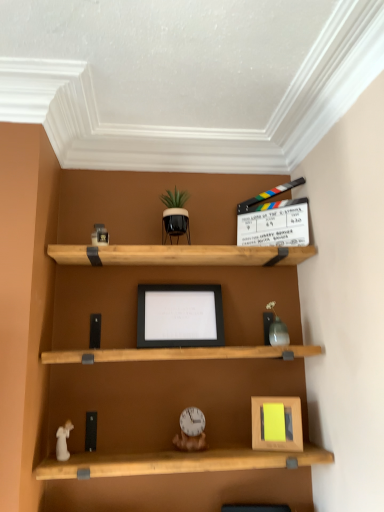
Question: Does white porcelain angel at lower left, marked as the 2th toy in a bottom-to-top arrangement, turn towards black matte picture frame at center, positioned as the first picture frame in back-to-front order?

Choices:
 (A) no
 (B) yes

Answer: (A)

Question: Considering the relative sizes of white porcelain angel at lower left, which is counted as the 3th toy, starting from the top, and black matte picture frame at center, placed as the second picture frame when sorted from bottom to top, in the image provided, is white porcelain angel at lower left, which is counted as the 3th toy, starting from the top, bigger than black matte picture frame at center, placed as the second picture frame when sorted from bottom to top,?

Choices:
 (A) yes
 (B) no

Answer: (B)

Question: Can you confirm if white porcelain angel at lower left, the first toy in the left-to-right sequence, is wider than black matte picture frame at center, placed as the second picture frame when sorted from bottom to top?

Choices:
 (A) yes
 (B) no

Answer: (B)

Question: Is white porcelain angel at lower left, positioned as the 4th toy in right-to-left order, positioned behind black matte picture frame at center, which is the first picture frame from left to right?

Choices:
 (A) no
 (B) yes

Answer: (A)

Question: Is white porcelain angel at lower left, marked as the 2th toy in a bottom-to-top arrangement, not close to black matte picture frame at center, which is the first picture frame from left to right?

Choices:
 (A) yes
 (B) no

Answer: (B)

Question: Does white porcelain angel at lower left, the first toy in the left-to-right sequence, have a lesser height compared to black matte picture frame at center, which is the first picture frame from left to right?

Choices:
 (A) yes
 (B) no

Answer: (A)

Question: Considering the relative sizes of wooden picture frame at lower right, placed as the 2th picture frame when sorted from left to right, and wooden clock at center, arranged as the fourth toy when viewed from the top, in the image provided, is wooden picture frame at lower right, placed as the 2th picture frame when sorted from left to right, bigger than wooden clock at center, arranged as the fourth toy when viewed from the top,?

Choices:
 (A) yes
 (B) no

Answer: (A)

Question: From the image's perspective, does wooden picture frame at lower right, placed as the 2th picture frame when sorted from left to right, appear higher than wooden clock at center, the second toy viewed from the right?

Choices:
 (A) yes
 (B) no

Answer: (A)

Question: Considering the relative positions of wooden picture frame at lower right, placed as the 2th picture frame when sorted from left to right, and wooden clock at center, arranged as the fourth toy when viewed from the top, in the image provided, is wooden picture frame at lower right, placed as the 2th picture frame when sorted from left to right, in front of wooden clock at center, arranged as the fourth toy when viewed from the top,?

Choices:
 (A) no
 (B) yes

Answer: (B)

Question: Can you confirm if wooden picture frame at lower right, which appears as the second picture frame when viewed from the back, is positioned to the right of wooden clock at center, arranged as the fourth toy when viewed from the top?

Choices:
 (A) no
 (B) yes

Answer: (B)

Question: Is wooden picture frame at lower right, which appears as the second picture frame when viewed from the back, smaller than wooden clock at center, which ranks as the 3th toy in left-to-right order?

Choices:
 (A) no
 (B) yes

Answer: (A)

Question: Is wooden picture frame at lower right, which is counted as the 2th picture frame, starting from the top, taller than wooden clock at center, the second toy viewed from the right?

Choices:
 (A) yes
 (B) no

Answer: (A)

Question: Is black matte picture frame at center, the 2th picture frame viewed from the right, beside matte gray vase at upper right, the 3th toy ordered from the bottom?

Choices:
 (A) no
 (B) yes

Answer: (A)